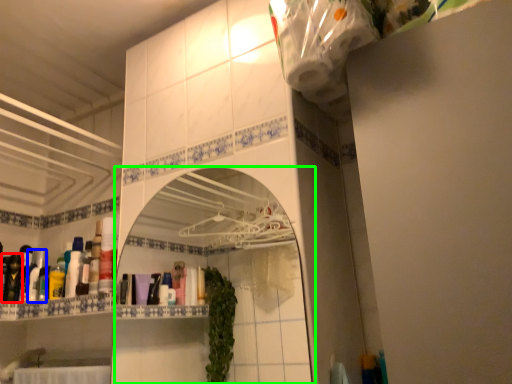
Question: Based on their relative distances, which object is farther from toiletry (highlighted by a red box)? Choose from toiletry (highlighted by a blue box) and mirror (highlighted by a green box).

Choices:
 (A) toiletry
 (B) mirror

Answer: (B)